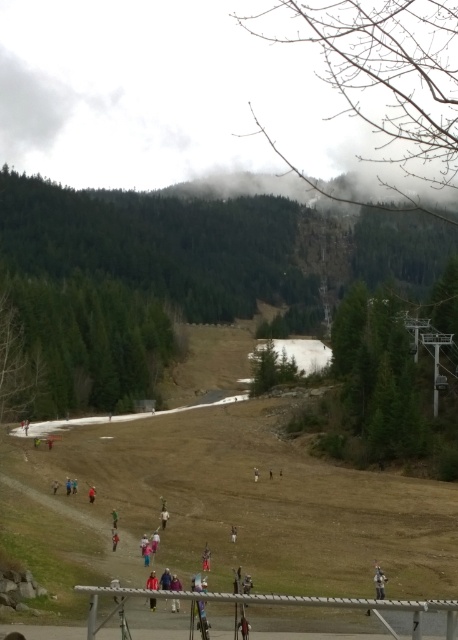
Question: Which of the following is the farthest from the observer?

Choices:
 (A) (75, 492)
 (B) (255, 481)

Answer: (B)

Question: Is red fabric jacket at center positioned in front of white matte snowboarder at center?

Choices:
 (A) yes
 (B) no

Answer: (A)

Question: Considering the real-world distances, which object is farthest from the blue fabric jacket at lower center?

Choices:
 (A) white snowboarder at center
 (B) white matte snowboarder at center
 (C) light gray fabric jacket at lower right

Answer: (C)

Question: Which object is closer to the camera taking this photo?

Choices:
 (A) white matte snowboarder at center
 (B) red fabric person at center
 (C) red jacket at center
 (D) red jacket at lower center

Answer: (D)

Question: Is light gray fabric jacket at lower right to the right of white snowboarder at center from the viewer's perspective?

Choices:
 (A) no
 (B) yes

Answer: (B)

Question: Is light blue fabric jacket at center closer to the viewer compared to light blue fabric jacket at lower center?

Choices:
 (A) no
 (B) yes

Answer: (A)